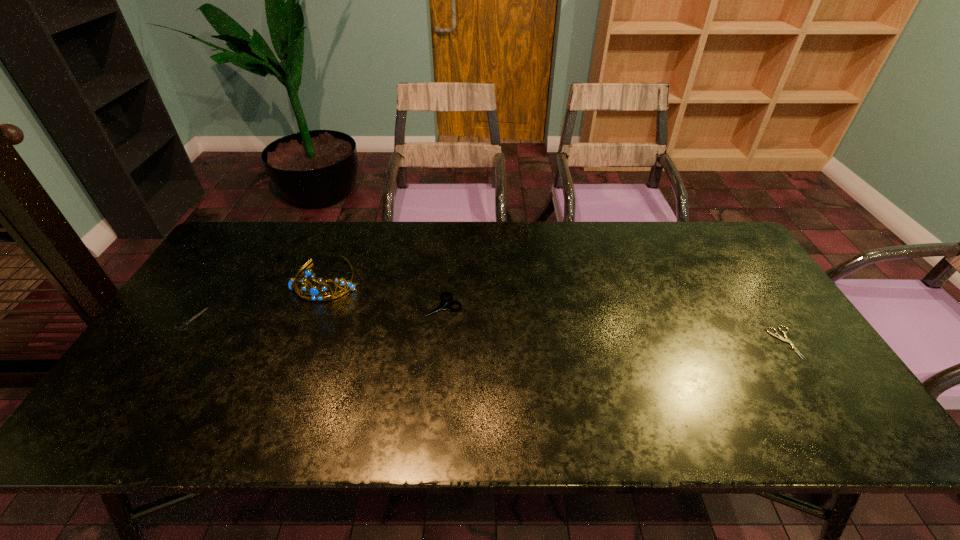
This screenshot has width=960, height=540. I want to click on empty space between the tiara and the rightmost shears, so click(x=556, y=311).

At what (x,y) coordinates should I click in order to perform the action: click on free point between the tiara and the tallest shears. Please return your answer as a coordinate pair (x, y). The width and height of the screenshot is (960, 540). Looking at the image, I should click on 385,293.

Locate an element on the screen. Image resolution: width=960 pixels, height=540 pixels. empty location between the leftmost shears and the rightmost shears is located at coordinates (488, 331).

You are a GUI agent. You are given a task and a screenshot of the screen. Output one action in this format:
    pyautogui.click(x=<x>, y=<y>)
    Task: Click on the vacant area between the second object from right to left and the leftmost object
    The image size is (960, 540).
    Given the screenshot: What is the action you would take?
    pyautogui.click(x=317, y=313)

This screenshot has width=960, height=540. In order to click on free space between the third shortest object and the tiara in this screenshot , I will do `click(385, 293)`.

The width and height of the screenshot is (960, 540). What are the coordinates of `vacant space in between the second shears from left to right and the leftmost object` in the screenshot? It's located at (317, 313).

The image size is (960, 540). What are the coordinates of `unoccupied area between the rightmost shears and the leftmost object` in the screenshot? It's located at (488, 331).

Where is `vacant space in between the tiara and the tallest shears`? Image resolution: width=960 pixels, height=540 pixels. vacant space in between the tiara and the tallest shears is located at coordinates (385, 293).

The width and height of the screenshot is (960, 540). Find the location of `free space between the tallest object and the leftmost object`. free space between the tallest object and the leftmost object is located at coordinates (259, 299).

Find the location of a particular element. Image resolution: width=960 pixels, height=540 pixels. object that is the third closest to the third object from right to left is located at coordinates (778, 336).